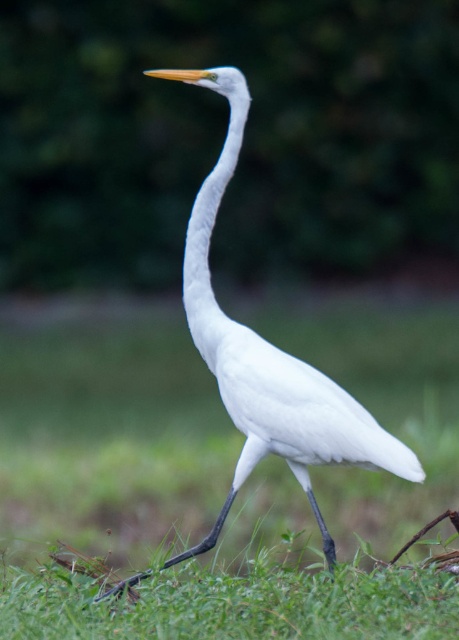
You are a wildlife photographer aiming to capture the Great Egret in the scene. You notice the white matte bird at center and the white smooth neck at center. Which object should you focus on to ensure the bird is the main subject, considering their sizes?

The white matte bird at center is taller than the white smooth neck at center, so focusing on the white matte bird at center will ensure the bird is the main subject due to its larger size.

You are a photographer who wants to capture a photo of the white matte bird at center. The camera is set to focus at point 0.5, 0.5. Will the bird be in focus?

The white matte bird at center is positioned at point (268, 356), which is close to the focus point (229, 320). Therefore, it will likely be in focus.